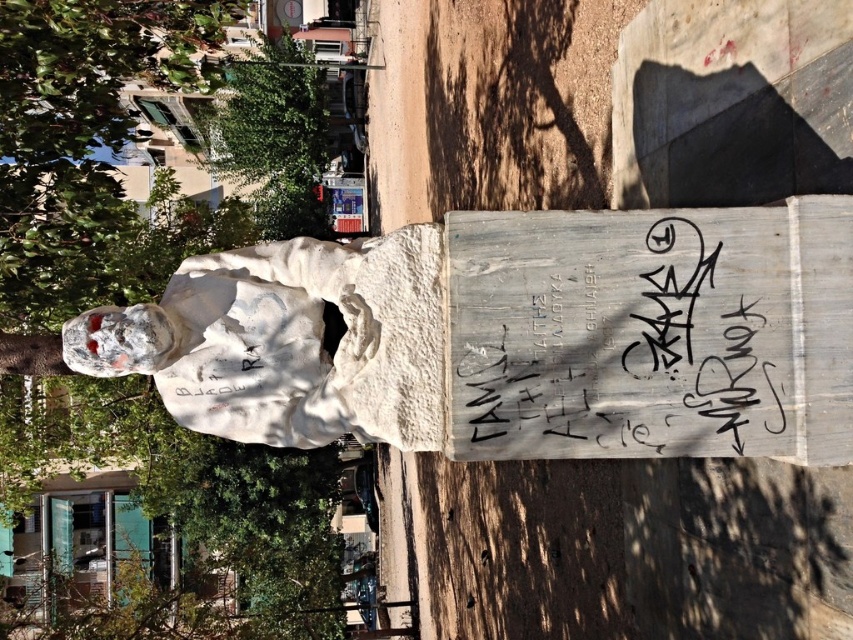
You are standing in a park and see a green leafy tree at upper left. You want to place a bench 5 meters away from the tree. Can you place it right where you are standing?

The distance between the green leafy tree at upper left and the viewer is 4.96 meters, so placing the bench right where you are standing would be approximately 5 meters away from the tree.

You are a maintenance worker needing to reach both the black painted wood sign at center and the green leafy tree at upper center. Given that your ladder is 12 meters long, can you safely reach both objects from your current position without moving the ladder?

The distance between the black painted wood sign at center and the green leafy tree at upper center is 13.12 meters. Since your ladder is only 12 meters long, it is too short to bridge the gap between them. You will need to move the ladder closer to either object to ensure safe access.